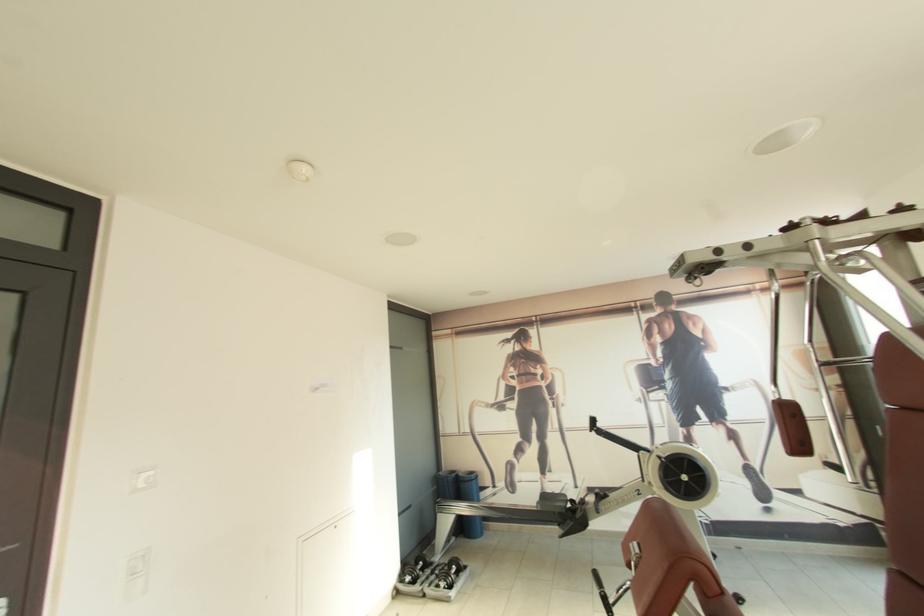
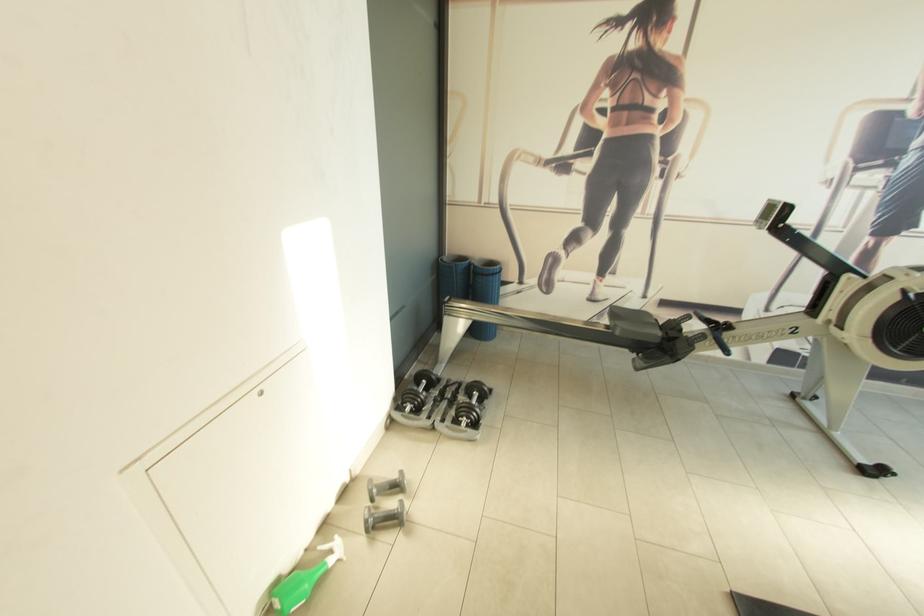
The point at (476, 475) is marked in the first image. Where is the corresponding point in the second image?

(497, 265)